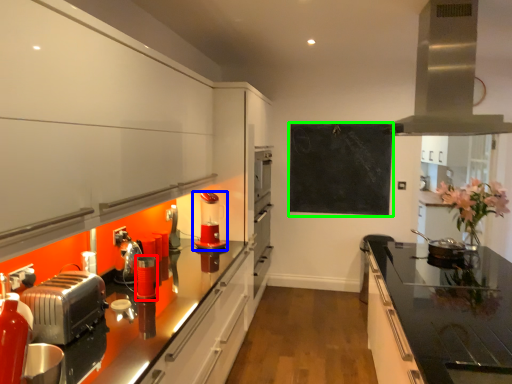
Question: Which is farther away from appliance (highlighted by a red box)? kitchen appliance (highlighted by a blue box) or bulletin board (highlighted by a green box)?

Choices:
 (A) kitchen appliance
 (B) bulletin board

Answer: (B)